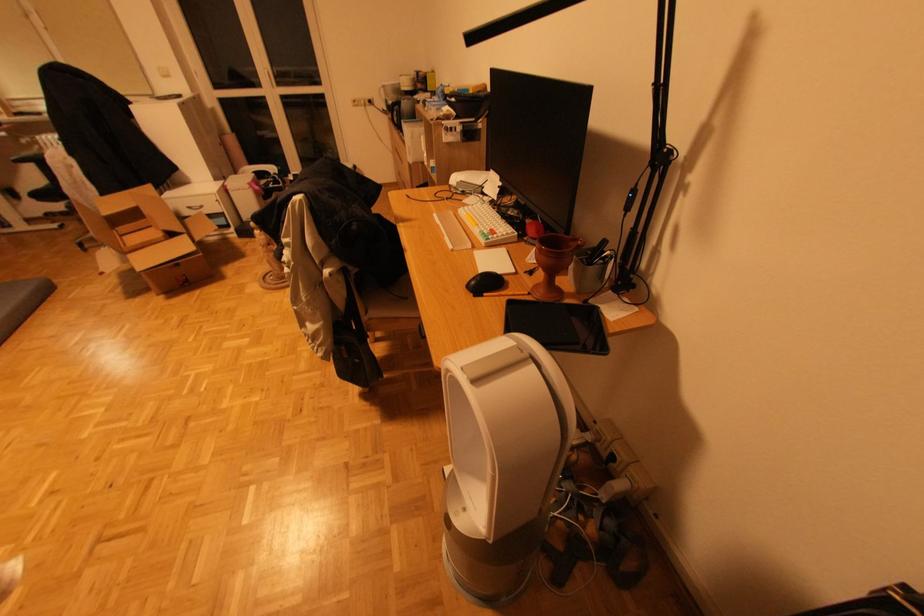
Describe the element at coordinates (484, 283) in the screenshot. I see `a black computer mouse` at that location.